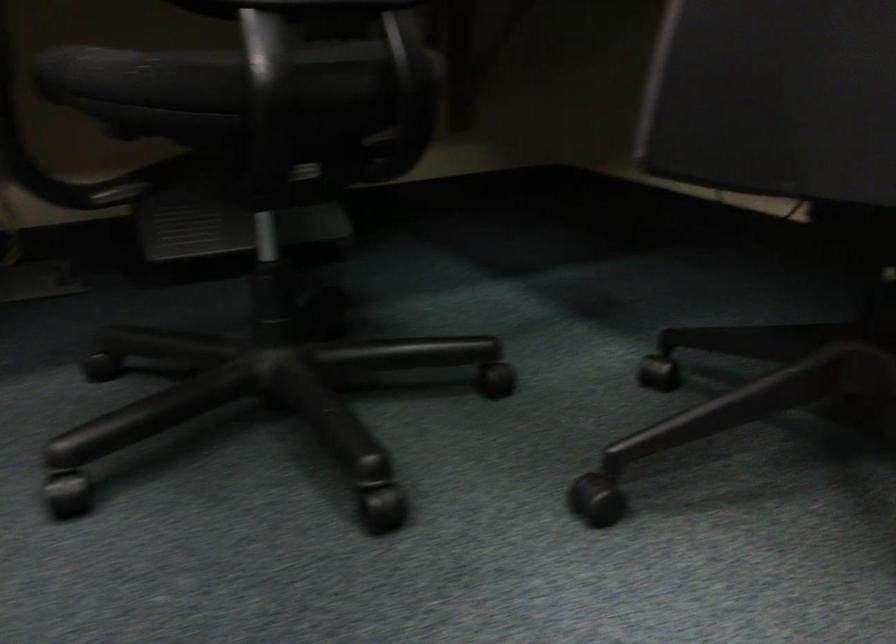
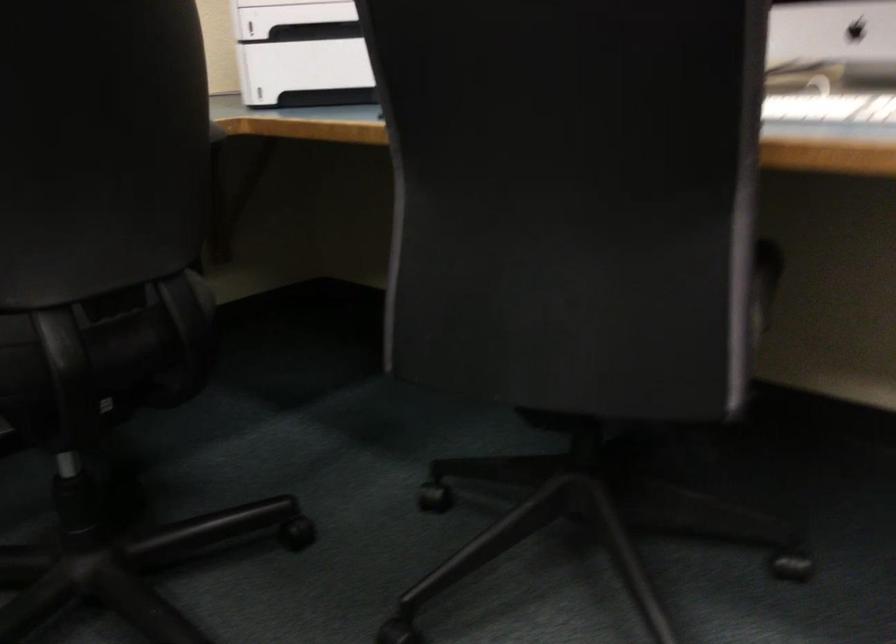
Question: How did the camera likely rotate?

Choices:
 (A) Left
 (B) Right
 (C) Up
 (D) Down

Answer: (B)